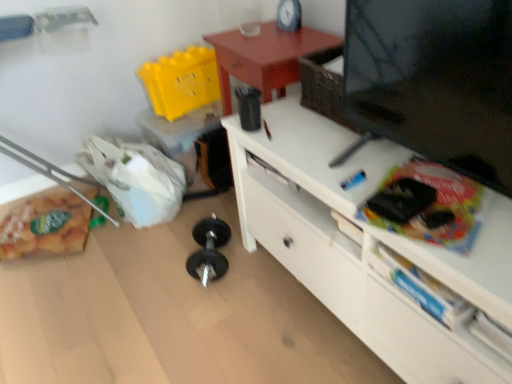
Question: Does matte black clock at upper center come in front of white matte drawer at lower right?

Choices:
 (A) no
 (B) yes

Answer: (A)

Question: Is matte black clock at upper center far away from white matte drawer at lower right?

Choices:
 (A) yes
 (B) no

Answer: (A)

Question: From the image's perspective, is matte black clock at upper center over white matte drawer at lower right?

Choices:
 (A) no
 (B) yes

Answer: (B)

Question: From a real-world perspective, is matte black clock at upper center under white matte drawer at lower right?

Choices:
 (A) no
 (B) yes

Answer: (A)

Question: Is matte black clock at upper center aimed at white matte drawer at lower right?

Choices:
 (A) no
 (B) yes

Answer: (A)

Question: Considering the relative positions of matte black clock at upper center and white matte drawer at lower right in the image provided, is matte black clock at upper center to the left of white matte drawer at lower right from the viewer's perspective?

Choices:
 (A) yes
 (B) no

Answer: (A)

Question: From a real-world perspective, is white matte drawer at lower right positioned under matte black clock at upper center based on gravity?

Choices:
 (A) yes
 (B) no

Answer: (A)

Question: Does white matte drawer at lower right have a lesser width compared to matte black clock at upper center?

Choices:
 (A) no
 (B) yes

Answer: (A)

Question: Is white matte drawer at lower right looking in the opposite direction of matte black clock at upper center?

Choices:
 (A) no
 (B) yes

Answer: (A)

Question: Considering the relative sizes of white matte drawer at lower right and matte black clock at upper center in the image provided, is white matte drawer at lower right wider than matte black clock at upper center?

Choices:
 (A) yes
 (B) no

Answer: (A)

Question: Considering the relative sizes of white matte drawer at lower right and matte black clock at upper center in the image provided, is white matte drawer at lower right shorter than matte black clock at upper center?

Choices:
 (A) no
 (B) yes

Answer: (B)

Question: Is the position of white matte drawer at lower right more distant than that of matte black clock at upper center?

Choices:
 (A) no
 (B) yes

Answer: (A)

Question: Is white matte drawer at lower right turned away from black matte tv at upper right?

Choices:
 (A) yes
 (B) no

Answer: (A)